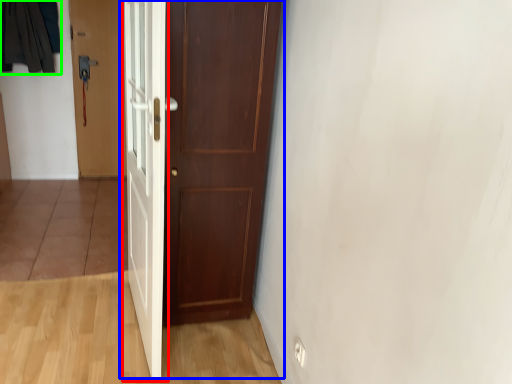
Question: Estimate the real-world distances between objects in this image. Which object is farther from door (highlighted by a red box), door (highlighted by a blue box) or clothing (highlighted by a green box)?

Choices:
 (A) door
 (B) clothing

Answer: (B)